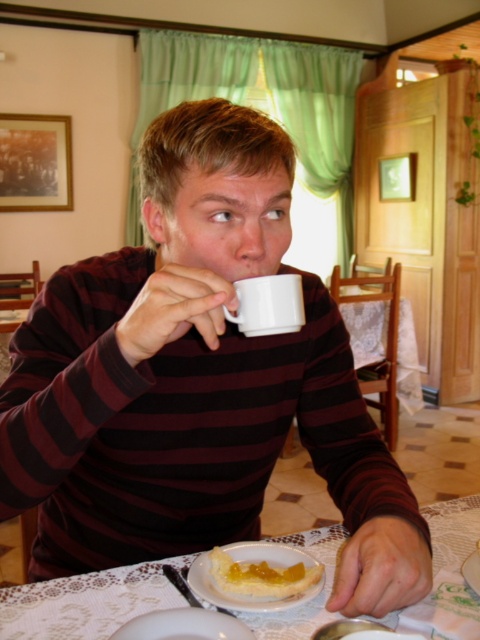
Question: Which of the following is the closest to the observer?

Choices:
 (A) (232, 572)
 (B) (255, 292)
 (C) (476, 554)
 (D) (382, 550)

Answer: (D)

Question: Observing the image, what is the correct spatial positioning of white lace tablecloth at lower center in reference to white ceramic plate at lower center?

Choices:
 (A) left
 (B) right

Answer: (A)

Question: Which object is closer to the camera taking this photo?

Choices:
 (A) white ceramic mug at upper center
 (B) yellow custard tart at lower center
 (C) white ceramic plate at lower center
 (D) white glossy plate at lower center

Answer: (D)

Question: Does white glossy mug at upper center appear over white ceramic plate at lower center?

Choices:
 (A) yes
 (B) no

Answer: (A)

Question: Considering the relative positions of white glossy mug at upper center and white lace tablecloth at lower center in the image provided, where is white glossy mug at upper center located with respect to white lace tablecloth at lower center?

Choices:
 (A) left
 (B) right

Answer: (A)

Question: Which is nearer to the white ceramic plate at lower center?

Choices:
 (A) white lace tablecloth at lower center
 (B) white ceramic mug at upper center
 (C) white glossy plate at lower center

Answer: (A)